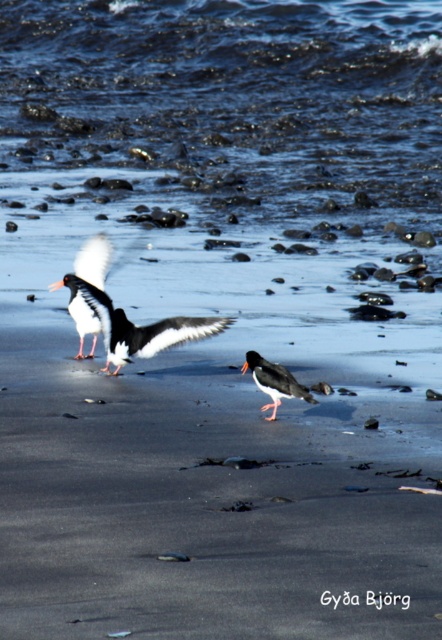
Does white matte bird at center have a smaller size compared to black glossy oystercatcher at center?

Actually, white matte bird at center might be larger than black glossy oystercatcher at center.

Does white matte bird at center have a lesser width compared to black glossy oystercatcher at center?

In fact, white matte bird at center might be wider than black glossy oystercatcher at center.

Is point (133, 330) positioned after point (281, 385)?

Yes, it is.

Identify the location of white matte bird at center. This screenshot has height=640, width=442. (124, 312).